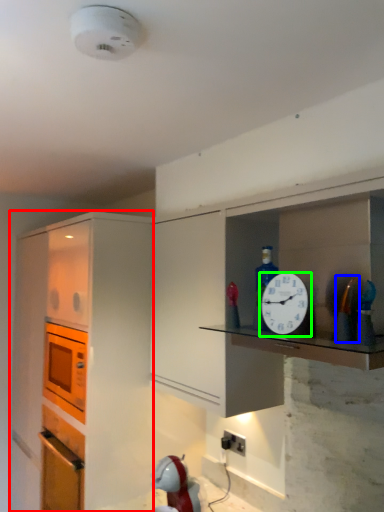
Question: Considering the real-world distances, which object is closest to cabinetry (highlighted by a red box)? toy (highlighted by a blue box) or clock (highlighted by a green box).

Choices:
 (A) toy
 (B) clock

Answer: (B)